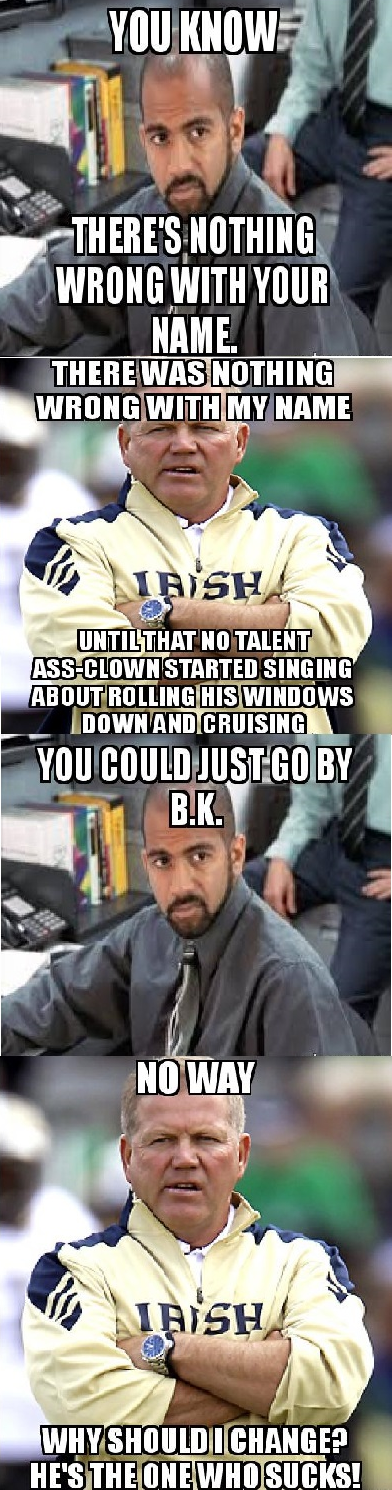
Identify the location of books. The height and width of the screenshot is (1490, 392). (86, 842), (99, 104).